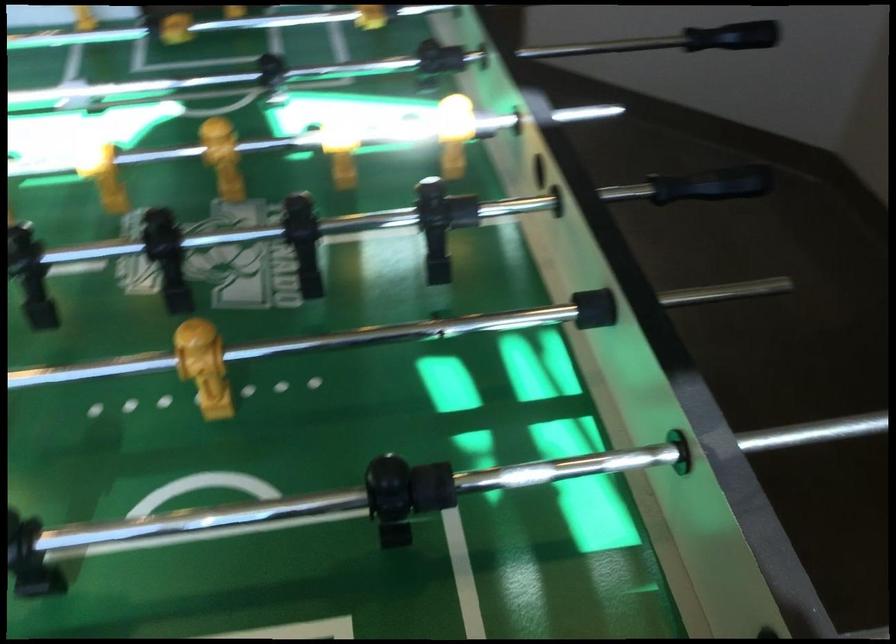
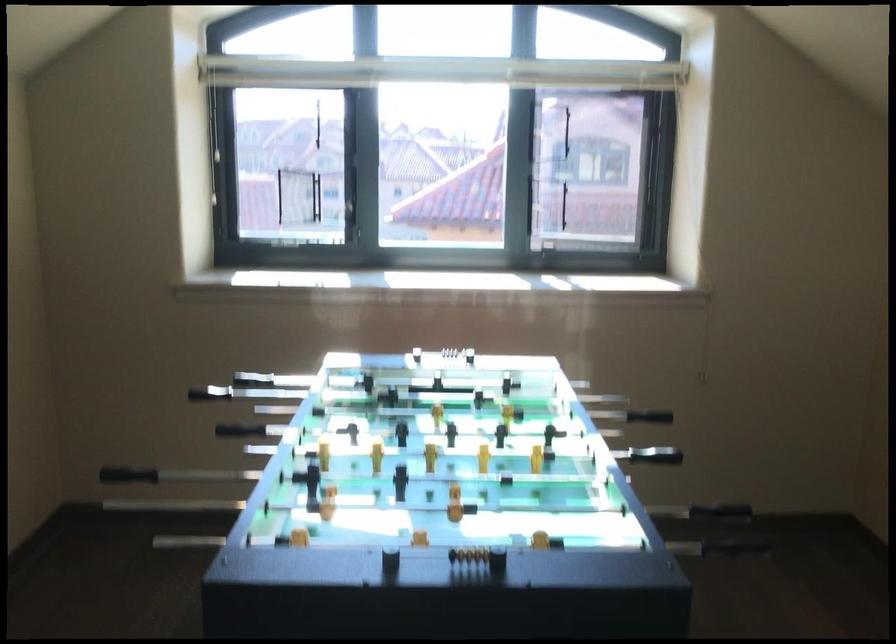
Find the pixel in the second image that matches point (711, 184) in the first image.

(219, 439)